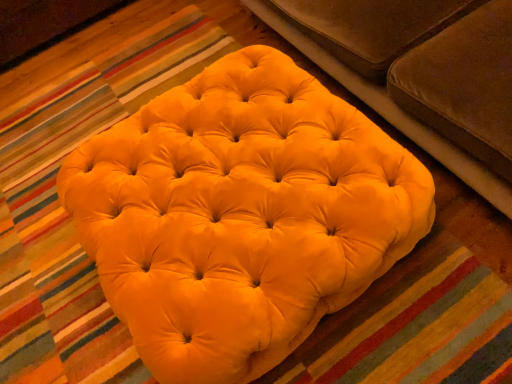
The image size is (512, 384). What do you see at coordinates (393, 113) in the screenshot?
I see `velvet brown studio couch at upper center` at bounding box center [393, 113].

The width and height of the screenshot is (512, 384). In order to click on velvet brown studio couch at upper center in this screenshot , I will do `click(393, 113)`.

This screenshot has width=512, height=384. Describe the element at coordinates (241, 215) in the screenshot. I see `matte yellow ottoman at center` at that location.

In order to click on matte yellow ottoman at center in this screenshot , I will do `click(241, 215)`.

The width and height of the screenshot is (512, 384). Identify the location of velvet brown studio couch at upper center. (393, 113).

Considering the relative positions of matte yellow ottoman at center and velvet brown studio couch at upper center in the image provided, is matte yellow ottoman at center to the left or to the right of velvet brown studio couch at upper center?

In the image, matte yellow ottoman at center appears on the left side of velvet brown studio couch at upper center.

Is matte yellow ottoman at center further to camera compared to velvet brown studio couch at upper center?

Yes.

Considering the points (197, 185) and (422, 125), which point is in front, point (197, 185) or point (422, 125)?

Positioned in front is point (197, 185).

From the image's perspective, does matte yellow ottoman at center appear higher than velvet brown studio couch at upper center?

Incorrect, from the image's perspective, matte yellow ottoman at center is lower than velvet brown studio couch at upper center.

From the picture: From a real-world perspective, is matte yellow ottoman at center physically above velvet brown studio couch at upper center?

No, from a real-world perspective, matte yellow ottoman at center is not above velvet brown studio couch at upper center.

Which object is thinner, matte yellow ottoman at center or velvet brown studio couch at upper center?

matte yellow ottoman at center is thinner.

From their relative heights in the image, would you say matte yellow ottoman at center is taller or shorter than velvet brown studio couch at upper center?

Considering their sizes, matte yellow ottoman at center has less height than velvet brown studio couch at upper center.

From the picture: Can you confirm if matte yellow ottoman at center is bigger than velvet brown studio couch at upper center?

No.

From the picture: Is matte yellow ottoman at center situated inside velvet brown studio couch at upper center or outside?

matte yellow ottoman at center exists outside the volume of velvet brown studio couch at upper center.

Is matte yellow ottoman at center directly adjacent to velvet brown studio couch at upper center?

No, matte yellow ottoman at center is not beside velvet brown studio couch at upper center.

Is matte yellow ottoman at center oriented away from velvet brown studio couch at upper center?

No.

Measure the distance from matte yellow ottoman at center to velvet brown studio couch at upper center.

matte yellow ottoman at center and velvet brown studio couch at upper center are 50.85 centimeters apart from each other.

Where is `furniture located underneath the velvet brown studio couch at upper center (from a real-world perspective)`? The image size is (512, 384). furniture located underneath the velvet brown studio couch at upper center (from a real-world perspective) is located at coordinates (241, 215).

Which is more to the left, velvet brown studio couch at upper center or matte yellow ottoman at center?

From the viewer's perspective, matte yellow ottoman at center appears more on the left side.

Does velvet brown studio couch at upper center come in front of matte yellow ottoman at center?

Yes, it is.

Does point (450, 157) appear closer or farther from the camera than point (205, 321)?

Point (450, 157) appears to be farther away from the viewer than point (205, 321).

Looking at this image, from the image's perspective, is velvet brown studio couch at upper center over matte yellow ottoman at center?

Correct, velvet brown studio couch at upper center appears higher than matte yellow ottoman at center in the image.

From a real-world perspective, is velvet brown studio couch at upper center below matte yellow ottoman at center?

Incorrect, from a real-world perspective, velvet brown studio couch at upper center is higher than matte yellow ottoman at center.

Is velvet brown studio couch at upper center wider than matte yellow ottoman at center?

Correct, the width of velvet brown studio couch at upper center exceeds that of matte yellow ottoman at center.

Can you confirm if velvet brown studio couch at upper center is shorter than matte yellow ottoman at center?

No.

Considering the relative sizes of velvet brown studio couch at upper center and matte yellow ottoman at center in the image provided, is velvet brown studio couch at upper center smaller than matte yellow ottoman at center?

Incorrect, velvet brown studio couch at upper center is not smaller in size than matte yellow ottoman at center.

Is matte yellow ottoman at center a part of velvet brown studio couch at upper center?

Actually, matte yellow ottoman at center is outside velvet brown studio couch at upper center.

Is velvet brown studio couch at upper center next to matte yellow ottoman at center?

No, velvet brown studio couch at upper center is not beside matte yellow ottoman at center.

Is velvet brown studio couch at upper center turned away from matte yellow ottoman at center?

No, matte yellow ottoman at center is not at the back of velvet brown studio couch at upper center.

How much distance is there between velvet brown studio couch at upper center and matte yellow ottoman at center?

velvet brown studio couch at upper center and matte yellow ottoman at center are 20.02 inches apart.

Locate an element on the screen. This screenshot has width=512, height=384. studio couch above the matte yellow ottoman at center (from the image's perspective) is located at coordinates (393, 113).

The image size is (512, 384). I want to click on studio couch located above the matte yellow ottoman at center (from a real-world perspective), so click(393, 113).

Find the location of a particular element. The height and width of the screenshot is (384, 512). furniture below the velvet brown studio couch at upper center (from the image's perspective) is located at coordinates (241, 215).